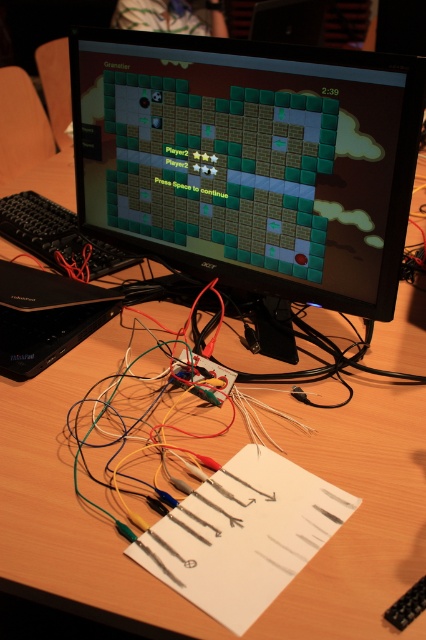
Can you confirm if black plastic monitor at center is taller than black plastic keyboard at left?

Correct, black plastic monitor at center is much taller as black plastic keyboard at left.

Who is positioned more to the left, black plastic monitor at center or black plastic keyboard at left?

Positioned to the left is black plastic keyboard at left.

Which is in front, point (98, 109) or point (43, 204)?

Point (98, 109) is more forward.

I want to click on black plastic monitor at center, so click(x=250, y=161).

Is point (138, 74) positioned after point (60, 324)?

No, it is not.

Measure the distance from black plastic monitor at center to black plastic laptop at center.

12.19 inches

What do you see at coordinates (250, 161) in the screenshot? Image resolution: width=426 pixels, height=640 pixels. I see `black plastic monitor at center` at bounding box center [250, 161].

The width and height of the screenshot is (426, 640). What are the coordinates of `black plastic monitor at center` in the screenshot? It's located at (250, 161).

Does black plastic laptop at center have a lesser width compared to black plastic keyboard at left?

Yes.

Which of these two, black plastic laptop at center or black plastic keyboard at left, stands shorter?

black plastic laptop at center is shorter.

Who is more distant from viewer, (34, 342) or (36, 236)?

Positioned behind is point (36, 236).

Find the location of a particular element. black plastic laptop at center is located at coordinates (46, 316).